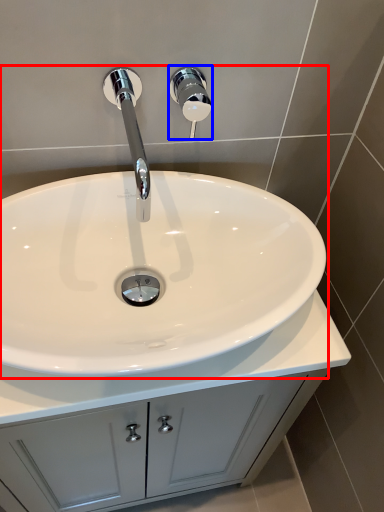
Question: Which object appears farthest to the camera in this image, sink (highlighted by a red box) or shower (highlighted by a blue box)?

Choices:
 (A) sink
 (B) shower

Answer: (B)